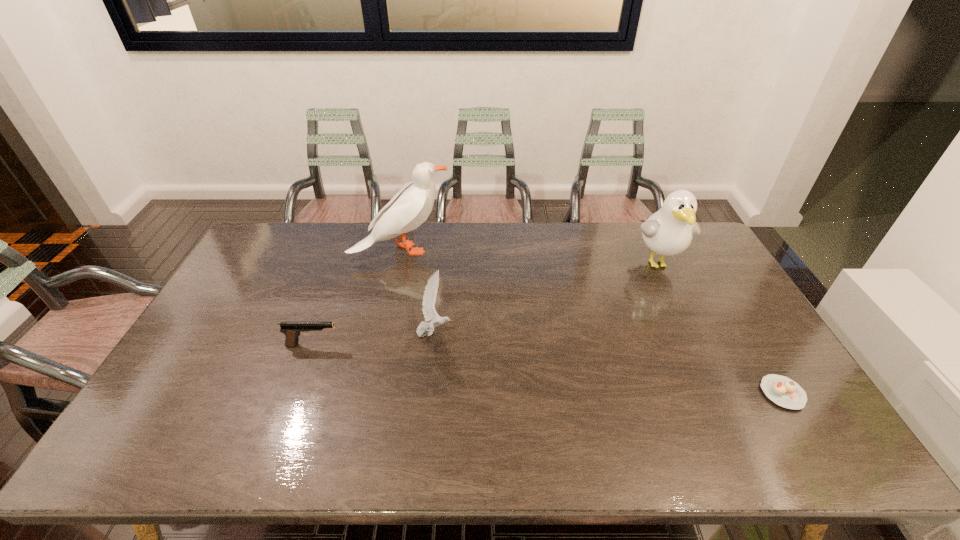
You are a GUI agent. You are given a task and a screenshot of the screen. Output one action in this format:
    pyautogui.click(x=<x>, y=<y>)
    Task: Click on the gull located in the right edge section of the desktop
    The width and height of the screenshot is (960, 540).
    Given the screenshot: What is the action you would take?
    pyautogui.click(x=668, y=232)

Identify the location of cupcake at the right edge. (783, 391).

Locate an element on the screen. object present at the far right corner is located at coordinates (668, 232).

In order to click on free location at the far edge of the desktop in this screenshot , I will do `click(367, 224)`.

Find the location of a particular element. free space at the near edge is located at coordinates (592, 450).

Image resolution: width=960 pixels, height=540 pixels. Find the location of `free space at the left edge of the desktop`. free space at the left edge of the desktop is located at coordinates (183, 376).

Identify the location of blank space at the right edge of the desktop. The image size is (960, 540). (704, 320).

Locate an element on the screen. This screenshot has width=960, height=540. blank space at the far left corner of the desktop is located at coordinates (271, 261).

The width and height of the screenshot is (960, 540). What are the coordinates of `free space at the near right corner of the desktop` in the screenshot? It's located at (800, 449).

Locate an element on the screen. Image resolution: width=960 pixels, height=540 pixels. vacant area that lies between the shortest object and the shortest gull is located at coordinates (609, 363).